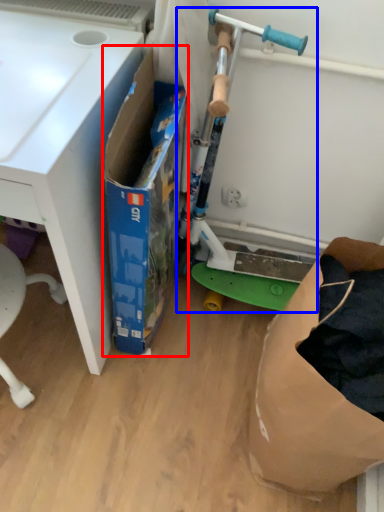
Question: Which of the following is the farthest to the observer, box (highlighted by a red box) or appliance (highlighted by a blue box)?

Choices:
 (A) box
 (B) appliance

Answer: (B)